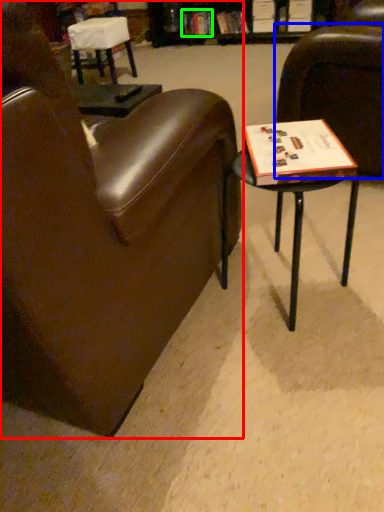
Question: Which object is positioned farthest from chair (highlighted by a red box)? Select from chair (highlighted by a blue box) and book (highlighted by a green box).

Choices:
 (A) chair
 (B) book

Answer: (B)